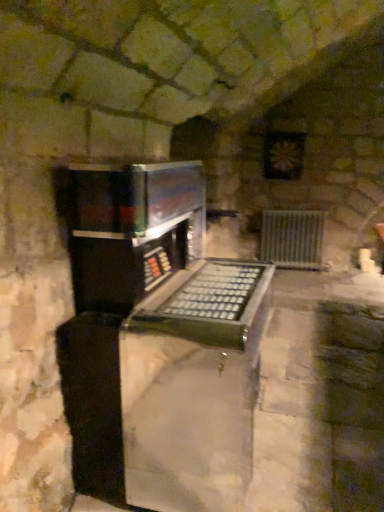
Question: Does metallic black keyboard at center come behind metallic silver radiator at center right?

Choices:
 (A) yes
 (B) no

Answer: (B)

Question: Considering the relative positions of metallic black keyboard at center and metallic silver radiator at center right in the image provided, is metallic black keyboard at center to the right of metallic silver radiator at center right from the viewer's perspective?

Choices:
 (A) no
 (B) yes

Answer: (A)

Question: From the image's perspective, does metallic black keyboard at center appear higher than metallic silver radiator at center right?

Choices:
 (A) yes
 (B) no

Answer: (B)

Question: Is metallic black keyboard at center directly adjacent to metallic silver radiator at center right?

Choices:
 (A) yes
 (B) no

Answer: (B)

Question: Can you confirm if metallic black keyboard at center is shorter than metallic silver radiator at center right?

Choices:
 (A) no
 (B) yes

Answer: (A)

Question: Is metallic black keyboard at center positioned in front of metallic silver radiator at center right?

Choices:
 (A) yes
 (B) no

Answer: (A)

Question: From a real-world perspective, is metallic silver radiator at center right beneath metallic black keyboard at center?

Choices:
 (A) yes
 (B) no

Answer: (A)

Question: From a real-world perspective, does metallic silver radiator at center right stand above metallic black keyboard at center?

Choices:
 (A) no
 (B) yes

Answer: (A)

Question: Is metallic silver radiator at center right wider than metallic black keyboard at center?

Choices:
 (A) no
 (B) yes

Answer: (A)

Question: Is the position of metallic silver radiator at center right less distant than that of metallic black keyboard at center?

Choices:
 (A) no
 (B) yes

Answer: (A)

Question: Does metallic silver radiator at center right have a lesser height compared to metallic black keyboard at center?

Choices:
 (A) yes
 (B) no

Answer: (A)

Question: Can you confirm if metallic silver radiator at center right is thinner than metallic black keyboard at center?

Choices:
 (A) no
 (B) yes

Answer: (B)

Question: Looking at the image, does metallic silver radiator at center right seem bigger or smaller compared to metallic black keyboard at center?

Choices:
 (A) small
 (B) big

Answer: (A)